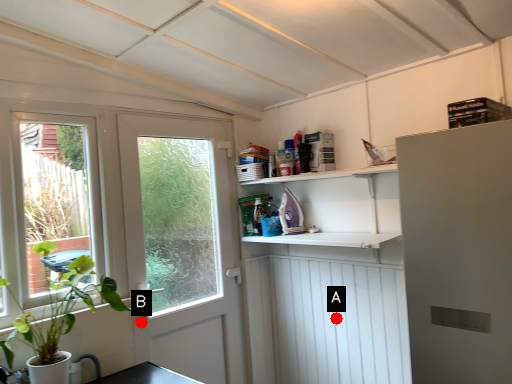
Question: Two points are circled on the image, labeled by A and B beside each circle. Which point is farther from the camera taking this photo?

Choices:
 (A) A is further
 (B) B is further

Answer: (A)